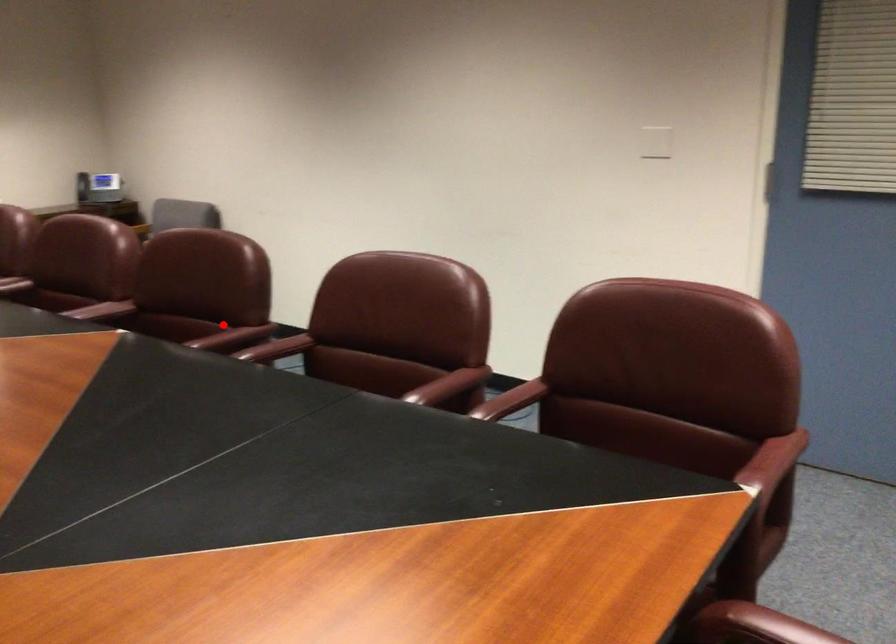
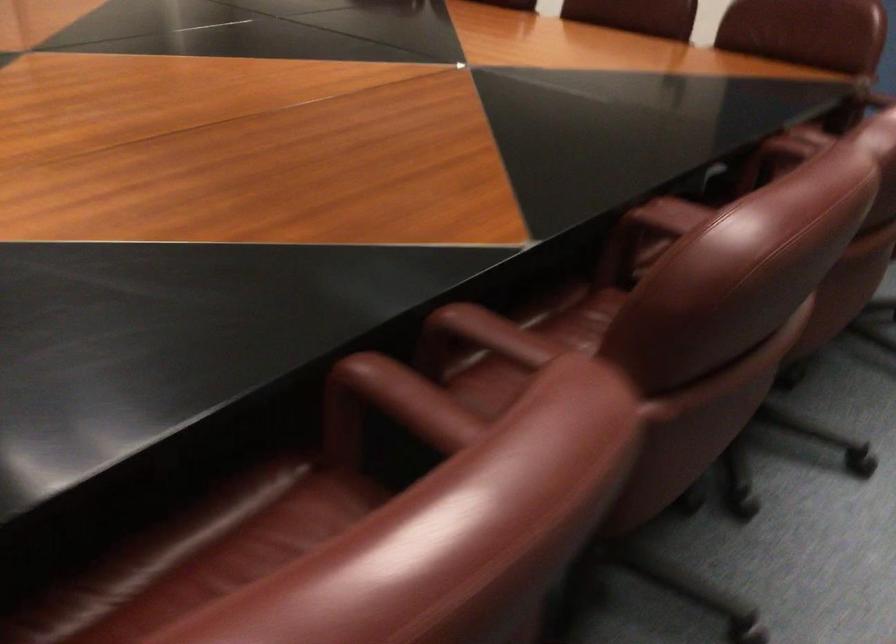
Question: I am providing you with two images of the same scene from different viewpoints. Image1 has a red point marked. In image2, the corresponding 3D location appears at what relative position? Reply with the corresponding letter.

Choices:
 (A) Closer
 (B) Farther

Answer: (A)